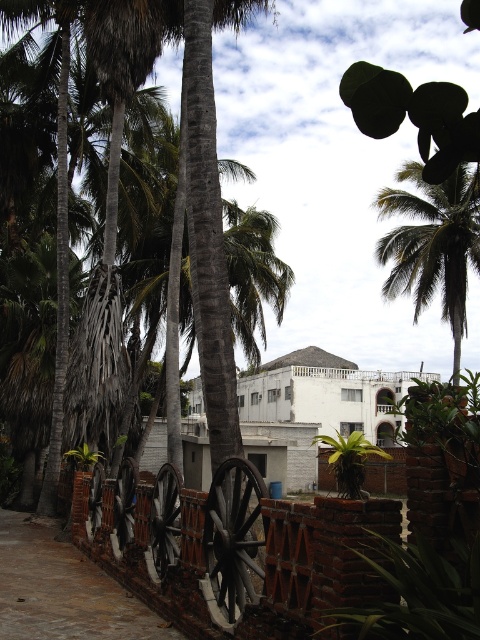
You are standing in a tropical garden and see the wooden wheels at lower center. If you want to touch them, how many steps do you need to take forward? Assume each step covers about 3 feet.

The wooden wheels at lower center are 22.62 feet away from you. Since each step covers about 3 feet, you would need to take approximately 8 steps forward to reach them.

You are standing in the tropical scene and want to take a photo of the brick wall at center without the green leafy palm tree at upper right blocking it. How should you position yourself to achieve this?

The brick wall at center is behind the green leafy palm tree at upper right, so to avoid the palm tree blocking the wall, you should move to a position where the palm tree is not between you and the wall. This could involve moving around to the side opposite the palm tree or positioning yourself so the palm tree is out of the frame.

You are an artist planning to paint the scene. You want to ensure that the wooden wheels at lower center and the brick wall at center are proportionally accurate. Based on the scene, which object should you paint smaller?

The wooden wheels at lower center should be painted smaller because they occupy less space than the brick wall at center according to the description.